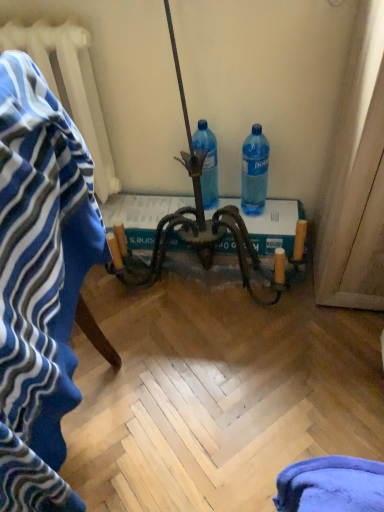
Image resolution: width=384 pixels, height=512 pixels. Describe the element at coordinates (40, 283) in the screenshot. I see `blue striped bath towel at left` at that location.

Describe the element at coordinates (70, 87) in the screenshot. I see `white textured radiator at upper left` at that location.

Locate an element on the screen. The image size is (384, 512). blue striped bath towel at left is located at coordinates (40, 283).

Is blue striped bath towel at left oriented away from white textured radiator at upper left?

No.

From a real-world perspective, is blue striped bath towel at left positioned above or below white textured radiator at upper left?

blue striped bath towel at left is above white textured radiator at upper left.

Considering the positions of objects blue striped bath towel at left and white textured radiator at upper left in the image provided, who is more to the left, blue striped bath towel at left or white textured radiator at upper left?

From the viewer's perspective, white textured radiator at upper left appears more on the left side.

Is blue striped bath towel at left situated inside white textured radiator at upper left or outside?

blue striped bath towel at left is located beyond the bounds of white textured radiator at upper left.

In the image, is white textured radiator at upper left on the left side or the right side of transparent plastic bottle at right, the 2th bottle viewed from the left?

Clearly, white textured radiator at upper left is on the left of transparent plastic bottle at right, the 2th bottle viewed from the left, in the image.

Considering the relative sizes of white textured radiator at upper left and transparent plastic bottle at right, the 2th bottle viewed from the left, in the image provided, is white textured radiator at upper left shorter than transparent plastic bottle at right, the 2th bottle viewed from the left,?

In fact, white textured radiator at upper left may be taller than transparent plastic bottle at right, the 2th bottle viewed from the left.

Identify the location of radiator on the left of the transparent plastic bottle at right, the 2th bottle viewed from the left. (70, 87).

In the scene shown: From a real-world perspective, relative to transparent plastic bottle at right, the 2th bottle viewed from the left, is white textured radiator at upper left vertically above or below?

From a real-world perspective, white textured radiator at upper left is physically above transparent plastic bottle at right, the 2th bottle viewed from the left.

Considering the relative sizes of blue plastic bottle at center, which is counted as the first bottle, starting from the left, and white textured radiator at upper left in the image provided, is blue plastic bottle at center, which is counted as the first bottle, starting from the left, smaller than white textured radiator at upper left?

Indeed, blue plastic bottle at center, which is counted as the first bottle, starting from the left, has a smaller size compared to white textured radiator at upper left.

Is white textured radiator at upper left completely or partially inside blue plastic bottle at center, which is counted as the first bottle, starting from the left?

No, white textured radiator at upper left is not inside blue plastic bottle at center, which is counted as the first bottle, starting from the left.

From a real-world perspective, which object stands above the other?

white textured radiator at upper left is physically above.

Based on the photo, from the image's perspective, between blue striped bath towel at left and blue plastic bottle at center, which is the 2th bottle from right to left, who is located below?

blue striped bath towel at left, from the image's perspective.

Which of these two, blue striped bath towel at left or blue plastic bottle at center, which is counted as the first bottle, starting from the left, stands taller?

blue striped bath towel at left.

Can you confirm if blue striped bath towel at left is bigger than blue plastic bottle at center, which is the 2th bottle from right to left?

Correct, blue striped bath towel at left is larger in size than blue plastic bottle at center, which is the 2th bottle from right to left.

Considering the relative sizes of transparent plastic bottle at right, positioned as the first bottle in right-to-left order, and blue plastic bottle at center, which is the 2th bottle from right to left, in the image provided, is transparent plastic bottle at right, positioned as the first bottle in right-to-left order, taller than blue plastic bottle at center, which is the 2th bottle from right to left,?

Indeed, transparent plastic bottle at right, positioned as the first bottle in right-to-left order, has a greater height compared to blue plastic bottle at center, which is the 2th bottle from right to left.

Considering the relative positions of transparent plastic bottle at right, the 2th bottle viewed from the left, and blue plastic bottle at center, which is the 2th bottle from right to left, in the image provided, is transparent plastic bottle at right, the 2th bottle viewed from the left, to the left of blue plastic bottle at center, which is the 2th bottle from right to left, from the viewer's perspective?

In fact, transparent plastic bottle at right, the 2th bottle viewed from the left, is to the right of blue plastic bottle at center, which is the 2th bottle from right to left.

From the image's perspective, is transparent plastic bottle at right, the 2th bottle viewed from the left, positioned above or below blue plastic bottle at center, which is the 2th bottle from right to left?

From the image's perspective, transparent plastic bottle at right, the 2th bottle viewed from the left, appears below blue plastic bottle at center, which is the 2th bottle from right to left.

From a real-world perspective, between transparent plastic bottle at right, the 2th bottle viewed from the left, and blue plastic bottle at center, which is the 2th bottle from right to left, who is vertically higher?

transparent plastic bottle at right, the 2th bottle viewed from the left, is physically above.

Can you confirm if white textured radiator at upper left is smaller than blue plastic bottle at center, which is counted as the first bottle, starting from the left?

No.

Would you say blue plastic bottle at center, which is the 2th bottle from right to left, is part of white textured radiator at upper left's contents?

No, blue plastic bottle at center, which is the 2th bottle from right to left, is not a part of white textured radiator at upper left.

Is point (28, 42) positioned after point (207, 131)?

No, (28, 42) is in front of (207, 131).

Is blue plastic bottle at center, which is the 2th bottle from right to left, in front of blue striped bath towel at left?

That is False.

How many degrees apart are the facing directions of blue plastic bottle at center, which is the 2th bottle from right to left, and blue striped bath towel at left?

They differ by 86.6 degrees in their facing directions.

Between blue plastic bottle at center, which is the 2th bottle from right to left, and blue striped bath towel at left, which one has larger width?

Wider between the two is blue striped bath towel at left.

Based on the photo, from a real-world perspective, between blue plastic bottle at center, which is counted as the first bottle, starting from the left, and blue striped bath towel at left, who is vertically higher?

blue striped bath towel at left.

You are a GUI agent. You are given a task and a screenshot of the screen. Output one action in this format:
    pyautogui.click(x=<x>, y=<y>)
    Task: Click on the bath towel above the white textured radiator at upper left (from a real-world perspective)
    
    Given the screenshot: What is the action you would take?
    pyautogui.click(x=40, y=283)

Locate an element on the screen. The width and height of the screenshot is (384, 512). radiator that is in front of the transparent plastic bottle at right, positioned as the first bottle in right-to-left order is located at coordinates (70, 87).

Looking at the image, which one is located closer to blue striped bath towel at left, transparent plastic bottle at right, the 2th bottle viewed from the left, or white textured radiator at upper left?

white textured radiator at upper left is positioned closer to the anchor blue striped bath towel at left.

When comparing their distances from transparent plastic bottle at right, positioned as the first bottle in right-to-left order, does blue striped bath towel at left or blue plastic bottle at center, which is the 2th bottle from right to left, seem closer?

blue plastic bottle at center, which is the 2th bottle from right to left, is positioned closer to the anchor transparent plastic bottle at right, positioned as the first bottle in right-to-left order.

Looking at the image, which one is located further to blue striped bath towel at left, blue plastic bottle at center, which is the 2th bottle from right to left, or transparent plastic bottle at right, positioned as the first bottle in right-to-left order?

transparent plastic bottle at right, positioned as the first bottle in right-to-left order, lies further to blue striped bath towel at left than the other object.

Based on their spatial positions, is transparent plastic bottle at right, positioned as the first bottle in right-to-left order, or blue plastic bottle at center, which is counted as the first bottle, starting from the left, closer to blue striped bath towel at left?

blue plastic bottle at center, which is counted as the first bottle, starting from the left, lies closer to blue striped bath towel at left than the other object.

Based on their spatial positions, is blue striped bath towel at left or white textured radiator at upper left further from transparent plastic bottle at right, the 2th bottle viewed from the left?

blue striped bath towel at left.

When comparing their distances from white textured radiator at upper left, does blue striped bath towel at left or transparent plastic bottle at right, positioned as the first bottle in right-to-left order, seem closer?

transparent plastic bottle at right, positioned as the first bottle in right-to-left order, is positioned closer to the anchor white textured radiator at upper left.

Looking at the image, which one is located closer to transparent plastic bottle at right, the 2th bottle viewed from the left, white textured radiator at upper left or blue plastic bottle at center, which is counted as the first bottle, starting from the left?

blue plastic bottle at center, which is counted as the first bottle, starting from the left, is closer to transparent plastic bottle at right, the 2th bottle viewed from the left.

Looking at the image, which one is located closer to blue plastic bottle at center, which is counted as the first bottle, starting from the left, white textured radiator at upper left or blue striped bath towel at left?

The object closer to blue plastic bottle at center, which is counted as the first bottle, starting from the left, is white textured radiator at upper left.

You are a GUI agent. You are given a task and a screenshot of the screen. Output one action in this format:
    pyautogui.click(x=<x>, y=<y>)
    Task: Click on the radiator between blue striped bath towel at left and blue plastic bottle at center, which is counted as the first bottle, starting from the left, in the front-back direction
    
    Given the screenshot: What is the action you would take?
    pyautogui.click(x=70, y=87)

The height and width of the screenshot is (512, 384). I want to click on bottle between blue striped bath towel at left and blue plastic bottle at center, which is the 2th bottle from right to left, from front to back, so click(x=254, y=172).

Find the location of a particular element. The width and height of the screenshot is (384, 512). bottle between white textured radiator at upper left and transparent plastic bottle at right, the 2th bottle viewed from the left is located at coordinates (207, 163).

The image size is (384, 512). Find the location of `radiator positioned between blue striped bath towel at left and transparent plastic bottle at right, positioned as the first bottle in right-to-left order, from near to far`. radiator positioned between blue striped bath towel at left and transparent plastic bottle at right, positioned as the first bottle in right-to-left order, from near to far is located at coordinates (70, 87).